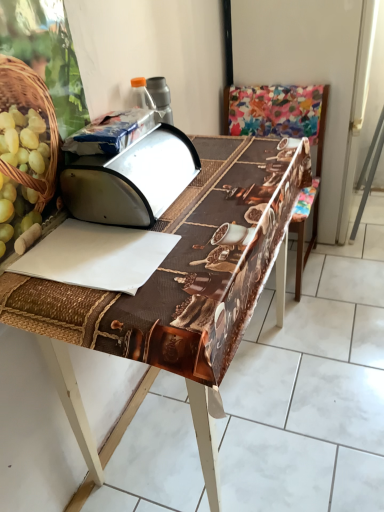
Locate an element on the screen. This screenshot has height=512, width=384. vacant area that lies between metallic silver breadbox at center and white paper at center, which ranks as the second wrapping paper in top-to-bottom order is located at coordinates (173, 207).